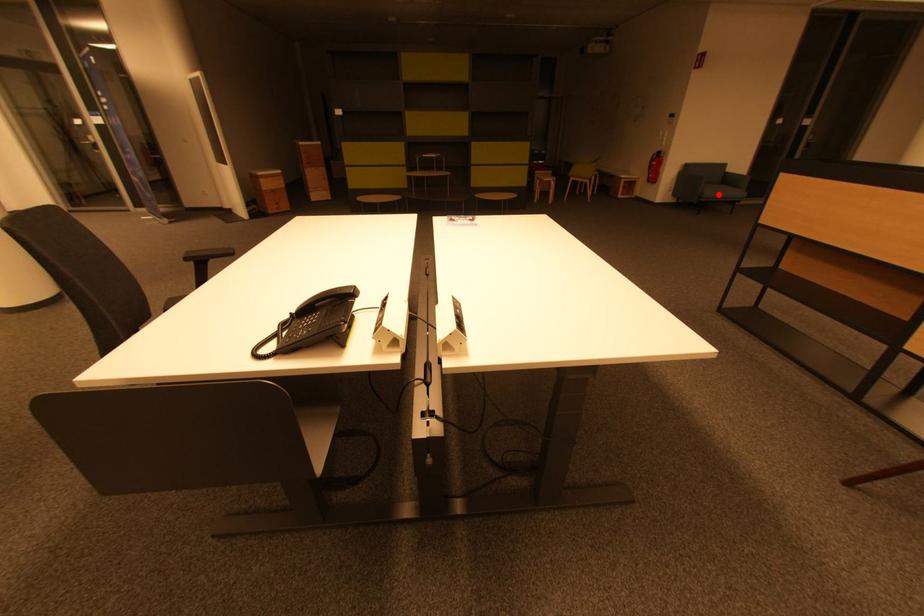
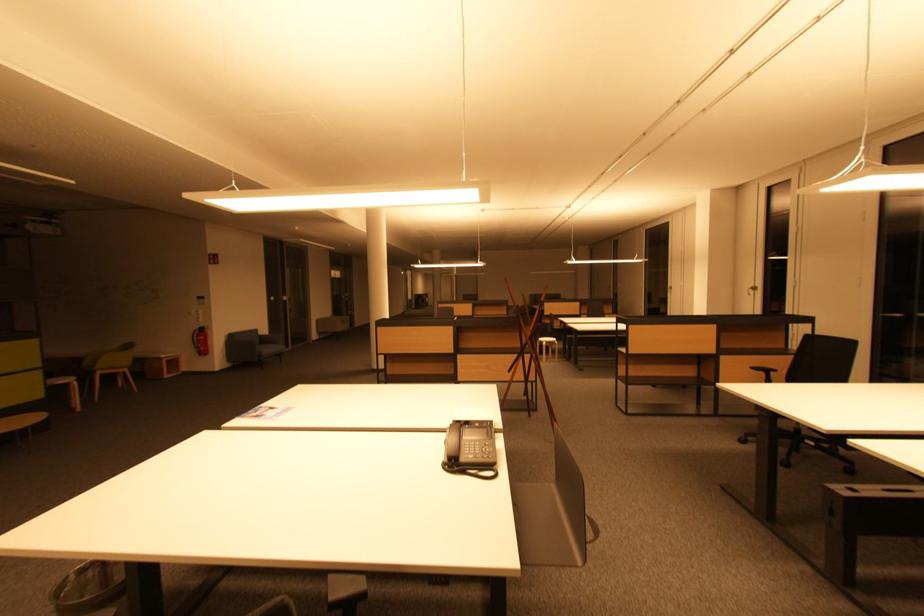
Where in the second image is the point corresponding to the highlighted location from the first image?

(272, 352)